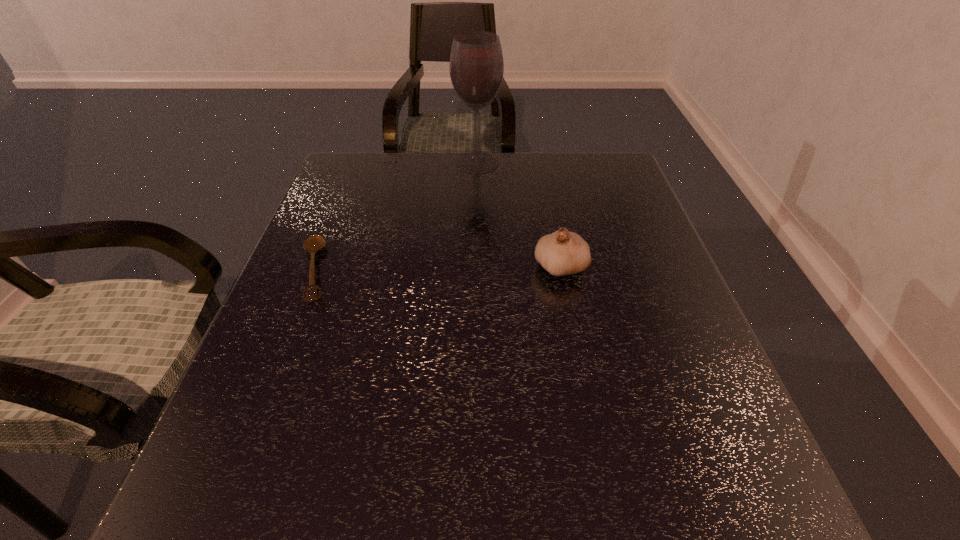
In order to click on the tallest object in this screenshot , I will do `click(476, 67)`.

Identify the location of alcohol. (476, 67).

This screenshot has height=540, width=960. In order to click on the second tallest object in this screenshot , I will do `click(561, 253)`.

Where is `garlic`? The width and height of the screenshot is (960, 540). garlic is located at coordinates (561, 253).

At what (x,y) coordinates should I click in order to perform the action: click on the leftmost object. Please return your answer as a coordinate pair (x, y). Looking at the image, I should click on (314, 243).

Where is `the shortest object`? This screenshot has width=960, height=540. the shortest object is located at coordinates (314, 243).

You are a GUI agent. You are given a task and a screenshot of the screen. Output one action in this format:
    pyautogui.click(x=<x>, y=<y>)
    Task: Click on the vacant region located 0.090m on the left of the alcohol
    
    Given the screenshot: What is the action you would take?
    pyautogui.click(x=423, y=163)

The width and height of the screenshot is (960, 540). What are the coordinates of `free space located 0.240m on the back of the second tallest object` in the screenshot? It's located at (546, 193).

Locate an element on the screen. The height and width of the screenshot is (540, 960). vacant space located 0.400m on the back of the shortest object is located at coordinates (360, 156).

This screenshot has height=540, width=960. What are the coordinates of `object located at the far edge` in the screenshot? It's located at (476, 67).